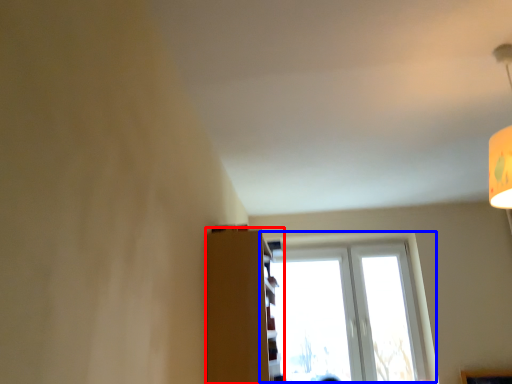
Question: Which object appears closest to the camera in this image, shelf (highlighted by a red box) or window (highlighted by a blue box)?

Choices:
 (A) shelf
 (B) window

Answer: (A)